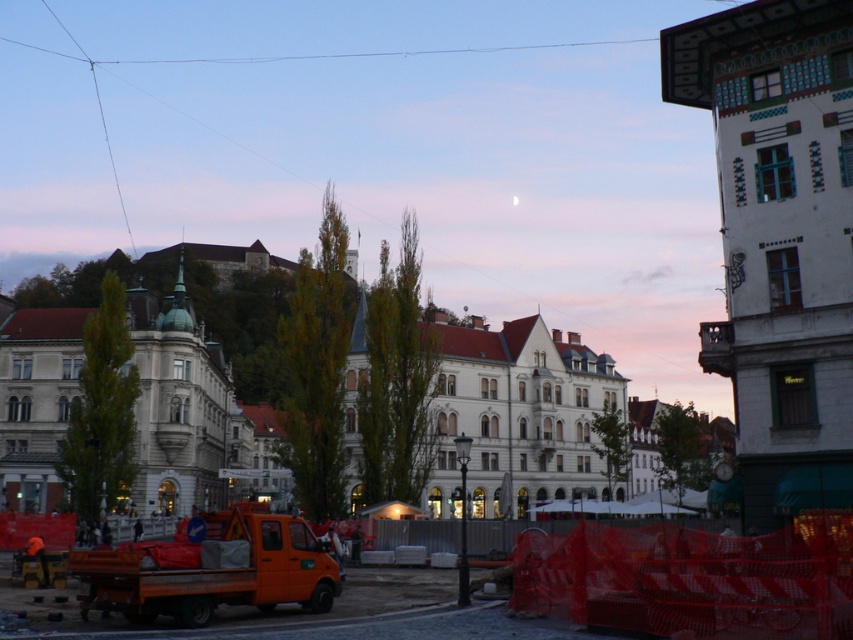
Question: Does orange fabric at lower left have a lesser width compared to orange mesh barricade at lower right?

Choices:
 (A) no
 (B) yes

Answer: (A)

Question: Estimate the real-world distances between objects in this image. Which object is farther from the orange matte truck at lower left?

Choices:
 (A) orange mesh barricade at lower right
 (B) orange fabric at lower left
 (C) white stone building at center

Answer: (C)

Question: Can you confirm if white stone building at center is bigger than orange mesh barricade at lower right?

Choices:
 (A) no
 (B) yes

Answer: (B)

Question: Does white stone building at center appear on the left side of orange matte truck at lower left?

Choices:
 (A) no
 (B) yes

Answer: (B)

Question: Which point is farther from the camera taking this photo?

Choices:
 (A) (827, 538)
 (B) (201, 611)
 (C) (138, 612)
 (D) (268, 465)

Answer: (D)

Question: Which of the following is the farthest from the observer?

Choices:
 (A) (572, 557)
 (B) (204, 564)

Answer: (B)